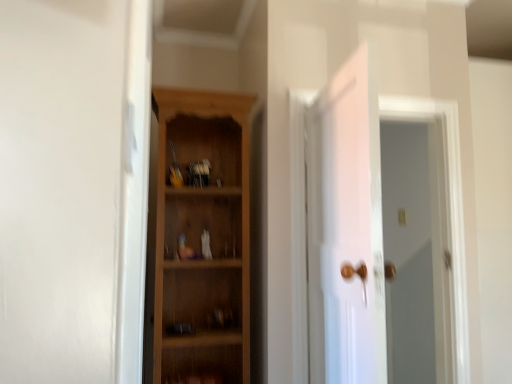
This screenshot has width=512, height=384. What are the coordinates of `white glossy door at upper right` in the screenshot? It's located at (416, 253).

What are the coordinates of `wooden cabinet at center` in the screenshot? It's located at (200, 236).

Locate an element on the screen. This screenshot has height=384, width=512. white glossy door at upper right is located at coordinates (416, 253).

Which object is closer to the camera taking this photo, wooden cabinet at center or white glossy door at center?

white glossy door at center is closer to the camera.

Does wooden cabinet at center have a larger size compared to white glossy door at center?

No, wooden cabinet at center is not bigger than white glossy door at center.

Where is `door in front of the wooden cabinet at center`? The height and width of the screenshot is (384, 512). door in front of the wooden cabinet at center is located at coordinates (346, 228).

Does white glossy door at upper right have a lesser width compared to wooden cabinet at center?

In fact, white glossy door at upper right might be wider than wooden cabinet at center.

Does white glossy door at upper right come in front of wooden cabinet at center?

Yes, it is.

Is white glossy door at upper right inside the boundaries of wooden cabinet at center, or outside?

white glossy door at upper right is not inside wooden cabinet at center, it's outside.

Does white glossy door at center touch wooden cabinet at center?

No, white glossy door at center is not beside wooden cabinet at center.

Is white glossy door at center oriented away from wooden cabinet at center?

No.

Based on the photo, does white glossy door at center have a greater height compared to wooden cabinet at center?

Incorrect, the height of white glossy door at center is not larger of that of wooden cabinet at center.

From the image's perspective, is white glossy door at center on wooden cabinet at center?

No, from the image's perspective, white glossy door at center is not on top of wooden cabinet at center.

Is white glossy door at center behind white glossy door at upper right?

No, the depth of white glossy door at center is less than that of white glossy door at upper right.

Is white glossy door at center turned away from white glossy door at upper right?

white glossy door at center is not turned away from white glossy door at upper right.

Is point (364, 239) positioned before point (398, 252)?

Yes, point (364, 239) is in front of point (398, 252).

How distant is white glossy door at center from white glossy door at upper right?

The distance of white glossy door at center from white glossy door at upper right is 33.05 inches.

From the image's perspective, which one is positioned lower, white glossy door at upper right or white glossy door at center?

white glossy door at upper right appears lower in the image.

Which is behind, white glossy door at upper right or white glossy door at center?

white glossy door at upper right.

Where is `screen door on the right of white glossy door at center`? Image resolution: width=512 pixels, height=384 pixels. screen door on the right of white glossy door at center is located at coordinates (416, 253).

Which is nearer, (x=392, y=348) or (x=366, y=74)?

Point (x=392, y=348) appears to be farther away from the viewer than point (x=366, y=74).

Considering the sizes of wooden cabinet at center and white glossy door at upper right in the image, is wooden cabinet at center bigger or smaller than white glossy door at upper right?

Clearly, wooden cabinet at center is larger in size than white glossy door at upper right.

How many degrees apart are the facing directions of wooden cabinet at center and white glossy door at upper right?

The angular difference between wooden cabinet at center and white glossy door at upper right is 2.83 degrees.

Is white glossy door at upper right a part of wooden cabinet at center?

No.

Measure the distance between wooden cabinet at center and white glossy door at upper right.

3.44 feet.

In the image, there is a wooden cabinet at center. At what (x,y) coordinates should I click in order to perform the action: click on door below it (from the image's perspective). Please return your answer as a coordinate pair (x, y). The height and width of the screenshot is (384, 512). Looking at the image, I should click on (346, 228).

At what (x,y) coordinates should I click in order to perform the action: click on screen door on the right of wooden cabinet at center. Please return your answer as a coordinate pair (x, y). Image resolution: width=512 pixels, height=384 pixels. Looking at the image, I should click on pos(416,253).

When comparing their distances from wooden cabinet at center, does white glossy door at center or white glossy door at upper right seem further?

The object further to wooden cabinet at center is white glossy door at upper right.

Based on their spatial positions, is white glossy door at center or wooden cabinet at center closer to white glossy door at upper right?

white glossy door at center lies closer to white glossy door at upper right than the other object.

Estimate the real-world distances between objects in this image. Which object is closer to wooden cabinet at center, white glossy door at upper right or white glossy door at center?

white glossy door at center.

When comparing their distances from white glossy door at center, does wooden cabinet at center or white glossy door at upper right seem further?

Among the two, white glossy door at upper right is located further to white glossy door at center.

Considering their positions, is wooden cabinet at center positioned closer to white glossy door at upper right than white glossy door at center?

white glossy door at center lies closer to white glossy door at upper right than the other object.

Looking at the image, which one is located closer to white glossy door at center, white glossy door at upper right or wooden cabinet at center?

Among the two, wooden cabinet at center is located nearer to white glossy door at center.

Where is `door between wooden cabinet at center and white glossy door at upper right from left to right`? The width and height of the screenshot is (512, 384). door between wooden cabinet at center and white glossy door at upper right from left to right is located at coordinates (346, 228).